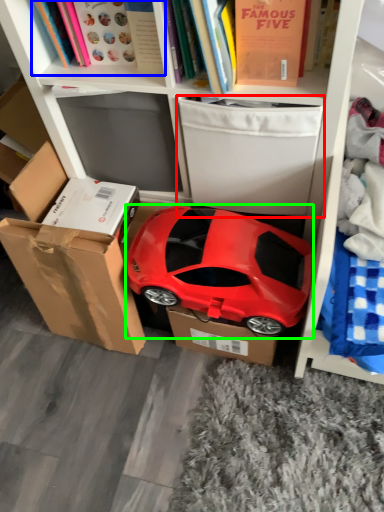
Question: Estimate the real-world distances between objects in this image. Which object is closer to storage box (highlighted by a red box), book (highlighted by a blue box) or car (highlighted by a green box)?

Choices:
 (A) book
 (B) car

Answer: (B)